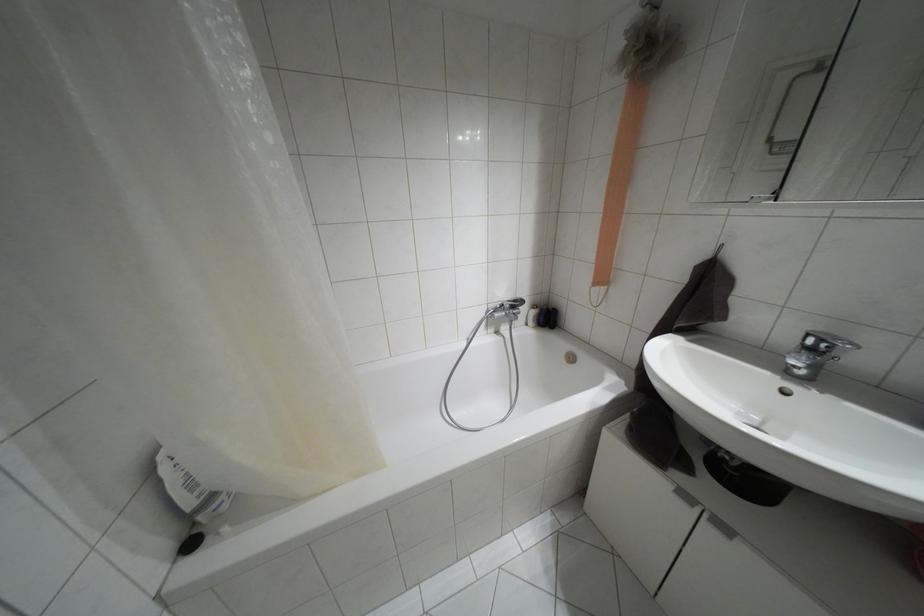
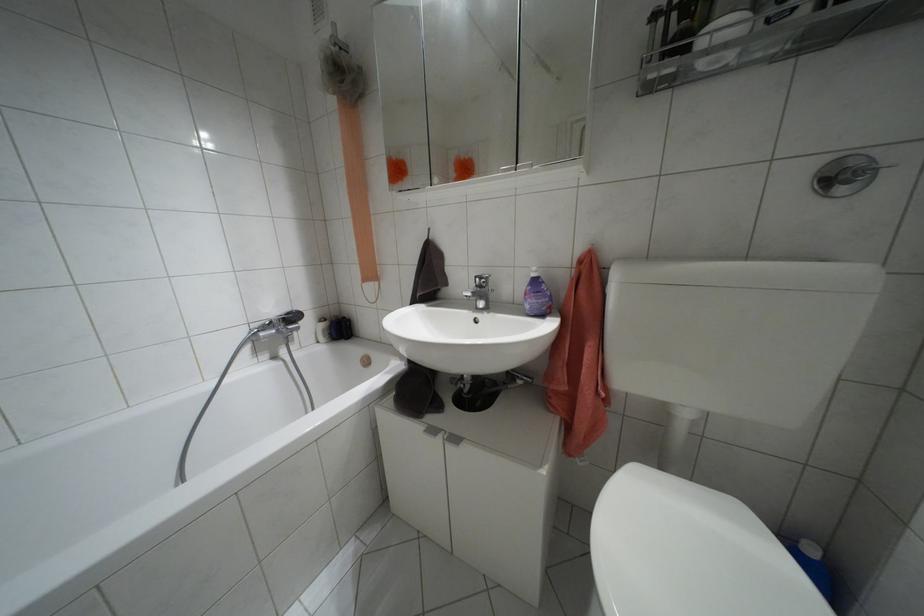
Find the pixel in the second image that matches [685,496] in the first image.

(432, 430)